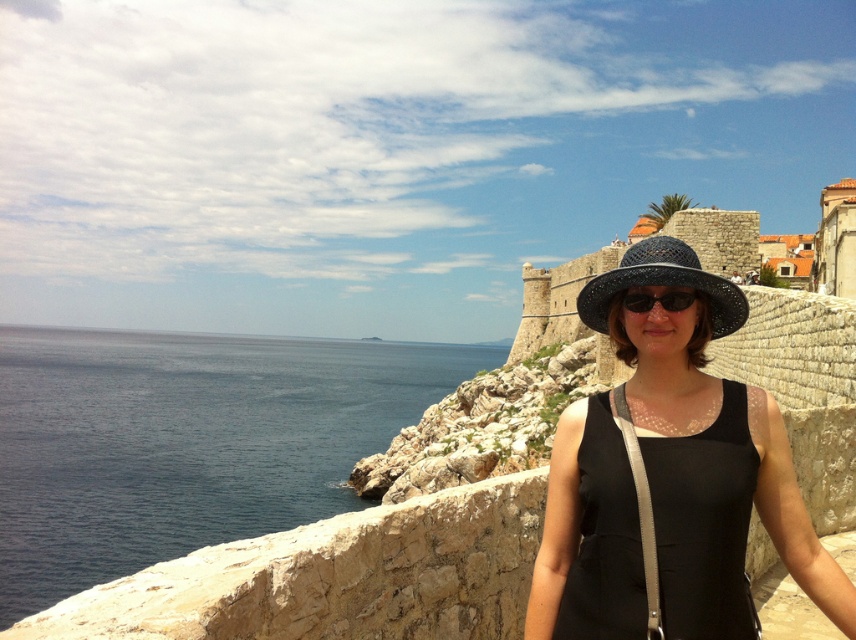
Question: Does black woven hat at center have a lesser width compared to blue woven hat at center?

Choices:
 (A) yes
 (B) no

Answer: (B)

Question: Does black woven hat at center appear over black matte sunglasses at center?

Choices:
 (A) no
 (B) yes

Answer: (A)

Question: Among these objects, which one is farthest from the camera?

Choices:
 (A) black matte sunglasses at center
 (B) blue woven hat at center
 (C) dark blue water at left

Answer: (C)

Question: Which of the following is the farthest from the observer?

Choices:
 (A) black woven hat at center
 (B) dark blue water at left

Answer: (B)

Question: Considering the relative positions of dark blue water at left and black matte sunglasses at center in the image provided, where is dark blue water at left located with respect to black matte sunglasses at center?

Choices:
 (A) above
 (B) below

Answer: (B)

Question: Considering the real-world distances, which object is farthest from the black woven hat at center?

Choices:
 (A) blue woven hat at center
 (B) dark blue water at left

Answer: (B)